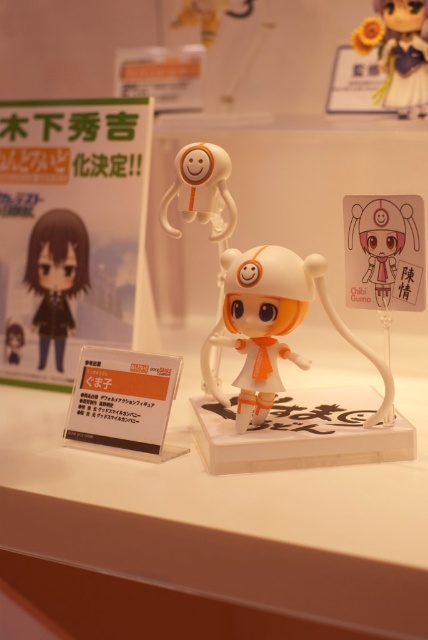
You are a collector who wants to take a photo of both the matte white plush at center and the matte white figurine at upper right. Which one will appear closer to the camera in the photo?

The matte white plush at center will appear closer to the camera in the photo because it is in front of the matte white figurine at upper right.

You are standing 1 meter away from the display of small figurines. Can you reach the point at coordinates point (44,394) without moving closer?

The distance of point (44,394) from viewer is 1.18 meters, so you are currently 1 meter away. Since 1.18 meters is farther than 1 meter, you cannot reach the point without moving closer.

You are standing at the origin point looking at the display of small figurines. There are two points marked on the image. Which of the two points, point (416, 204) or point (389, 24), is closer to you?

Point (416, 204) is in front of point (389, 24), so it is closer to you.